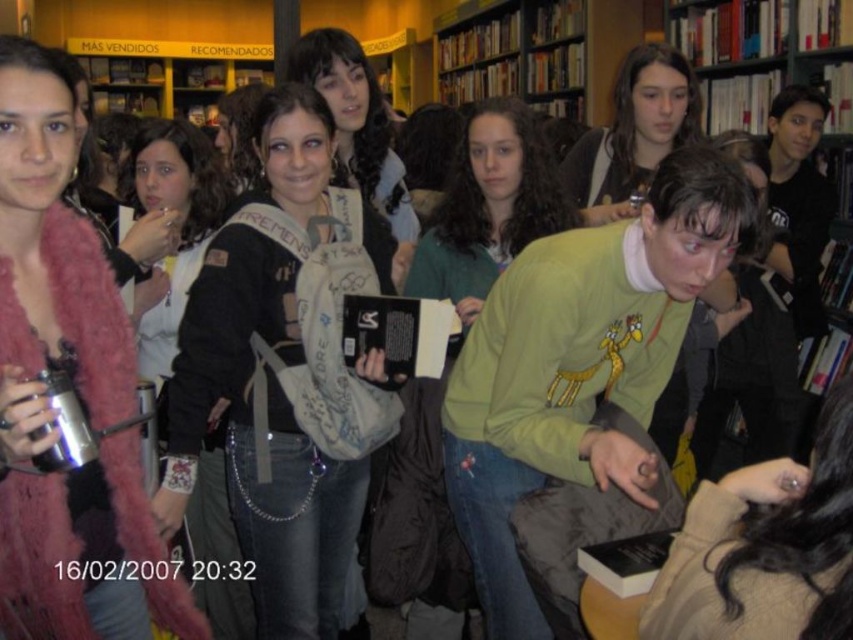
You are a photographer standing in the bookstore scene. You want to take a photo of both the green matte shirt at center and the matte green sweater at center without cropping either. What is the minimum width of the camera frame needed to capture both subjects?

The minimum width of the camera frame needed to capture both the green matte shirt at center and the matte green sweater at center is 40.65 centimeters.